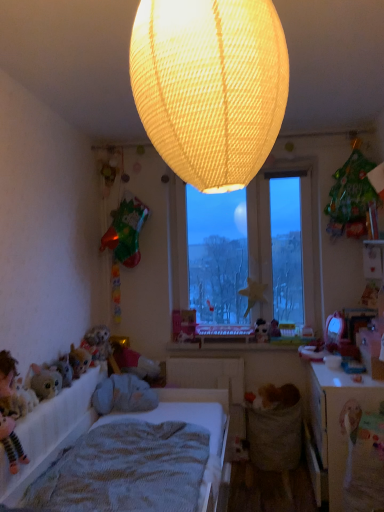
Question: From the image's perspective, is matte yellow fabric lampshade at upper center positioned above or below green matte bag at upper right, the first toy from the right?

Choices:
 (A) above
 (B) below

Answer: (A)

Question: Looking at their shapes, would you say matte yellow fabric lampshade at upper center is wider or thinner than green matte bag at upper right, the first toy in the top-to-bottom sequence?

Choices:
 (A) thin
 (B) wide

Answer: (B)

Question: Estimate the real-world distances between objects in this image. Which object is closer to the green matte bag at upper right, the first toy from the right?

Choices:
 (A) white fabric bed at lower left
 (B) smooth plastic window sill at center
 (C) matte plastic toy at center, marked as the first toy in a left-to-right arrangement
 (D) fluffy plush toy at lower left
 (E) wooden table at lower right

Answer: (B)

Question: Which is nearer to the green matte bag at upper right, the first toy from the right?

Choices:
 (A) transparent glass window at center
 (B) gray plush toy at lower left
 (C) knitted fabric mattress at lower left
 (D) wooden table at lower right
 (E) smooth plastic window sill at center

Answer: (A)